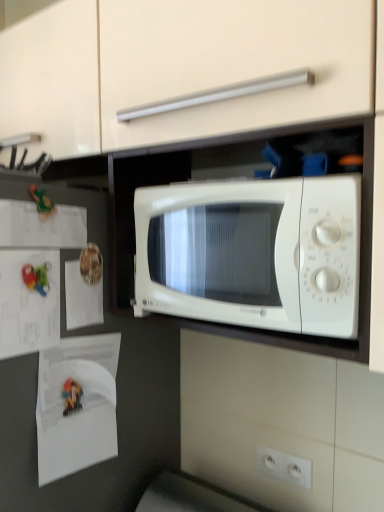
Question: From a real-world perspective, is white paper at left, arranged as the third paper when ordered from the bottom, under white plastic electric outlet at lower center?

Choices:
 (A) no
 (B) yes

Answer: (A)

Question: Does white paper at left, which is the 2th paper in top-to-bottom order, have a smaller size compared to white plastic electric outlet at lower center?

Choices:
 (A) yes
 (B) no

Answer: (B)

Question: Can you confirm if white paper at left, which is the 2th paper in top-to-bottom order, is positioned to the left of white plastic electric outlet at lower center?

Choices:
 (A) no
 (B) yes

Answer: (B)

Question: Is the position of white paper at left, which is the 2th paper in top-to-bottom order, more distant than that of white plastic electric outlet at lower center?

Choices:
 (A) yes
 (B) no

Answer: (B)

Question: From the image's perspective, is white paper at left, arranged as the third paper when ordered from the bottom, under white plastic electric outlet at lower center?

Choices:
 (A) yes
 (B) no

Answer: (B)

Question: Choose the correct answer: Is white matte microwave at center inside white plastic electric outlet at lower center or outside it?

Choices:
 (A) outside
 (B) inside

Answer: (A)

Question: Visually, is white matte microwave at center positioned to the left or to the right of white plastic electric outlet at lower center?

Choices:
 (A) right
 (B) left

Answer: (B)

Question: From a real-world perspective, is white matte microwave at center physically located above or below white plastic electric outlet at lower center?

Choices:
 (A) above
 (B) below

Answer: (A)

Question: Is white matte microwave at center bigger or smaller than white plastic electric outlet at lower center?

Choices:
 (A) small
 (B) big

Answer: (B)

Question: Visually, is white paper at left, the 1th paper in the bottom-to-top sequence, positioned to the left or to the right of green rubber toy at left?

Choices:
 (A) right
 (B) left

Answer: (A)

Question: Is white paper at left, the 4th paper positioned from the top, inside the boundaries of green rubber toy at left, or outside?

Choices:
 (A) outside
 (B) inside

Answer: (A)

Question: From a real-world perspective, is white paper at left, the 1th paper in the bottom-to-top sequence, physically located above or below green rubber toy at left?

Choices:
 (A) below
 (B) above

Answer: (A)

Question: Looking at their shapes, would you say white paper at left, the 1th paper in the bottom-to-top sequence, is wider or thinner than green rubber toy at left?

Choices:
 (A) wide
 (B) thin

Answer: (A)

Question: In terms of size, does white paper at left, the 1th paper in the bottom-to-top sequence, appear bigger or smaller than white paper at left, marked as the 1th paper in a top-to-bottom arrangement?

Choices:
 (A) small
 (B) big

Answer: (B)

Question: Considering the positions of white paper at left, the 4th paper positioned from the top, and white paper at left, marked as the 4th paper in a bottom-to-top arrangement, in the image, is white paper at left, the 4th paper positioned from the top, wider or thinner than white paper at left, marked as the 4th paper in a bottom-to-top arrangement,?

Choices:
 (A) wide
 (B) thin

Answer: (A)